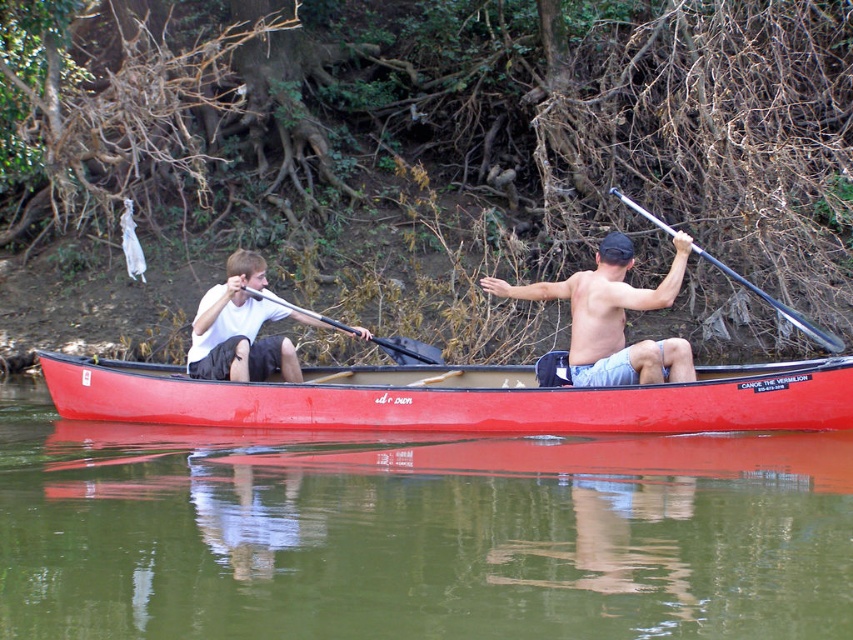
This screenshot has width=853, height=640. Describe the element at coordinates (613, 317) in the screenshot. I see `shiny blue shorts at center` at that location.

The width and height of the screenshot is (853, 640). What do you see at coordinates (613, 317) in the screenshot?
I see `shiny blue shorts at center` at bounding box center [613, 317].

Identify the location of shiny blue shorts at center. (613, 317).

Which of these two, green smooth water at center or matte white t-shirt at left, stands shorter?

With less height is green smooth water at center.

Which is behind, point (335, 536) or point (225, 340)?

The point (225, 340) is behind.

The height and width of the screenshot is (640, 853). In order to click on green smooth water at center in this screenshot , I will do `click(416, 532)`.

Between matte white t-shirt at left and metallic silver paddle at right, which one has more height?

metallic silver paddle at right

Does matte white t-shirt at left have a greater width compared to metallic silver paddle at right?

No.

The height and width of the screenshot is (640, 853). What are the coordinates of `matte white t-shirt at left` in the screenshot? It's located at (241, 328).

Where is `matte white t-shirt at left`? This screenshot has height=640, width=853. matte white t-shirt at left is located at coordinates (241, 328).